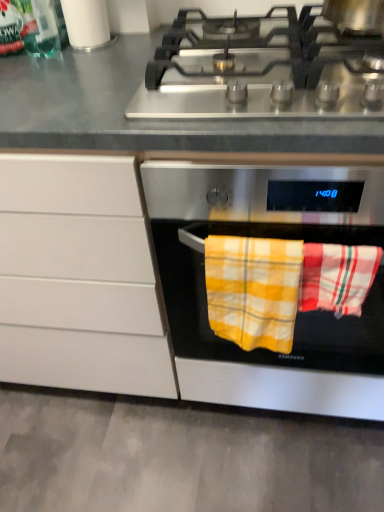
Question: From a real-world perspective, relative to metallic silver pot at upper right, is white matte cabinet at center vertically above or below?

Choices:
 (A) below
 (B) above

Answer: (A)

Question: From the image's perspective, relative to metallic silver pot at upper right, is white matte cabinet at center above or below?

Choices:
 (A) above
 (B) below

Answer: (B)

Question: Estimate the real-world distances between objects in this image. Which object is farther from the white paper towel at upper left?

Choices:
 (A) stainless steel oven at center
 (B) red plaid beach towel at center, placed as the second beach towel when sorted from left to right
 (C) metallic silver pot at upper right
 (D) white matte cabinet at center
 (E) yellow plaid towel at center, which is the 1th beach towel from left to right

Answer: (B)

Question: Based on their relative distances, which object is nearer to the stainless steel gas stove at upper center?

Choices:
 (A) metallic silver pot at upper right
 (B) yellow plaid towel at center, which is the 1th beach towel from left to right
 (C) white paper towel at upper left
 (D) stainless steel oven at center
 (E) red plaid beach towel at center, the first beach towel when ordered from right to left

Answer: (A)